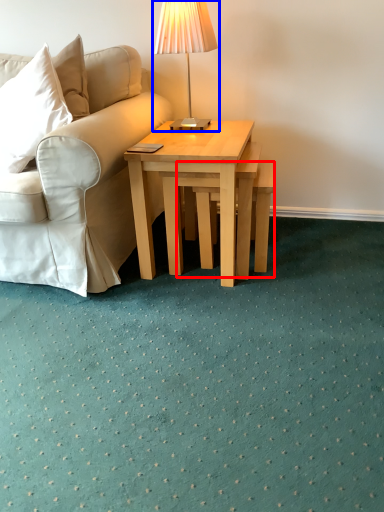
Question: Which of the following is the farthest to the observer, stool (highlighted by a red box) or table lamp (highlighted by a blue box)?

Choices:
 (A) stool
 (B) table lamp

Answer: (A)